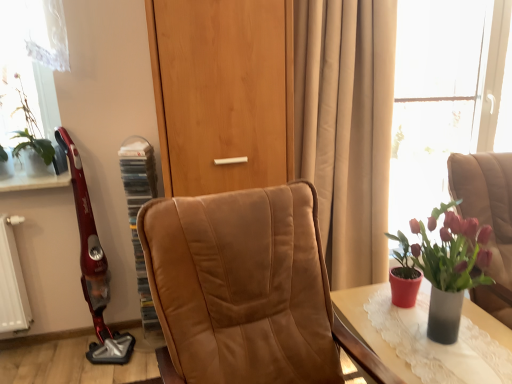
Find the location of a particular element. The image size is (512, 384). vacant space that is to the left of purple matte vase at right, marked as the first houseplant in a right-to-left arrangement is located at coordinates (384, 336).